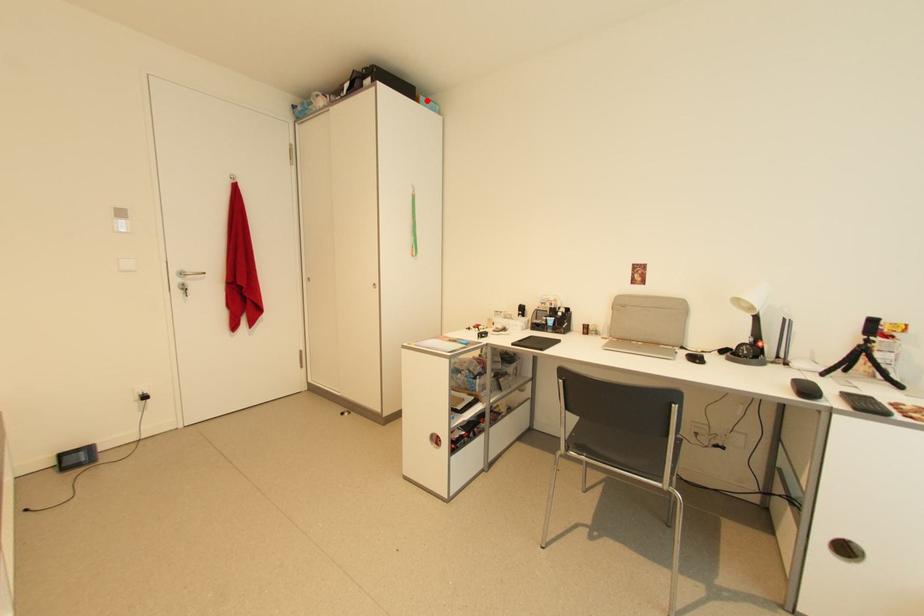
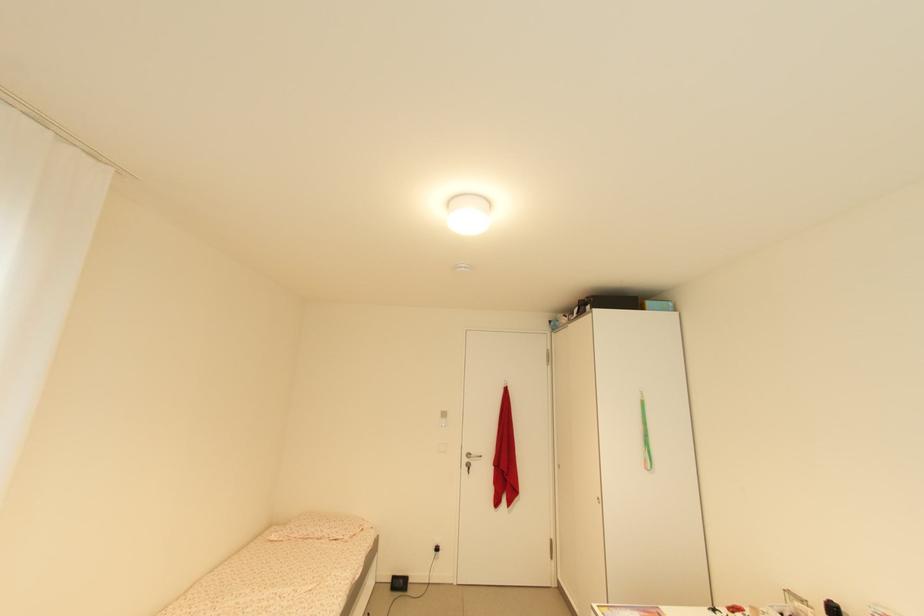
In the second image, find the point that corresponds to the highlighted location in the first image.

(652, 304)